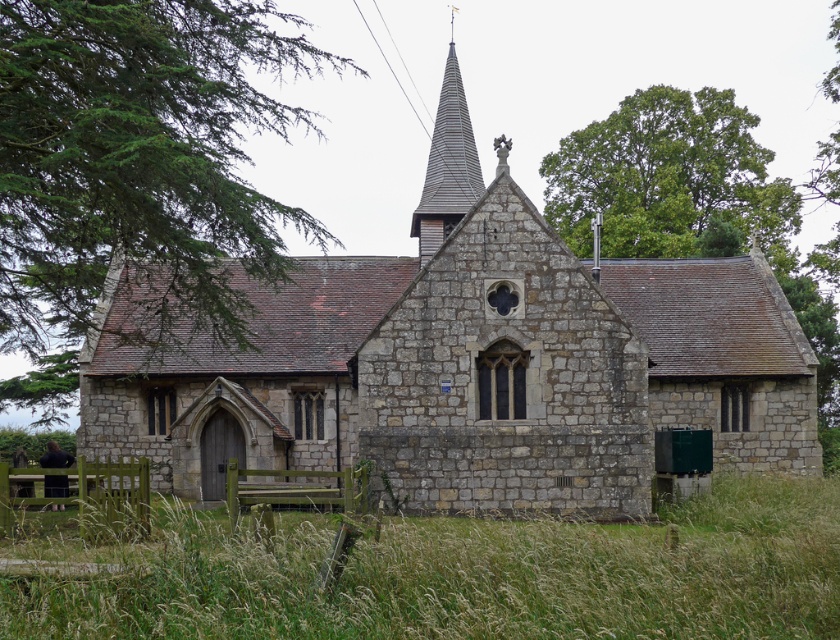
You are standing in front of the church and want to know which object is taller between the green leafy tree at upper left and the gray shingled spire at center. Can you determine this?

The green leafy tree at upper left has a greater height compared to the gray shingled spire at center, so the green leafy tree at upper left is taller.